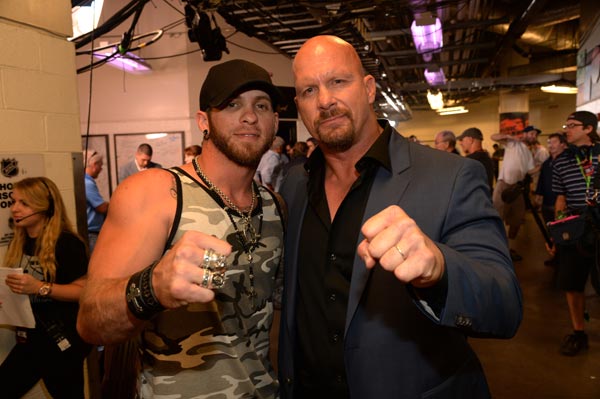
I want to click on mirror, so click(98, 141), click(162, 140).